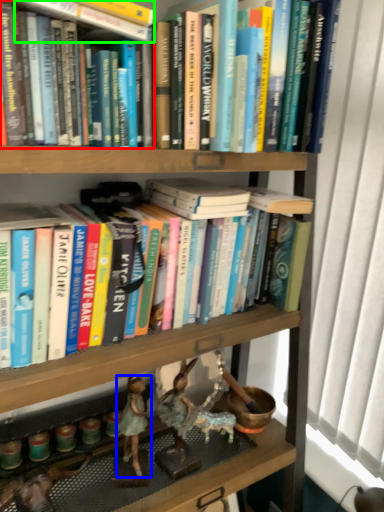
Question: Which is nearer to the book (highlighted by a red box)? person (highlighted by a blue box) or book (highlighted by a green box).

Choices:
 (A) person
 (B) book

Answer: (B)